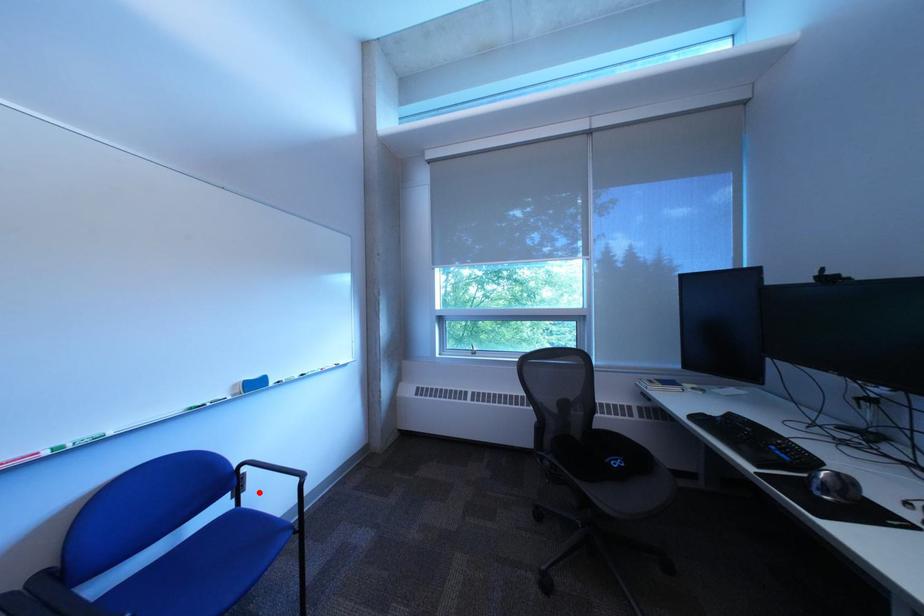
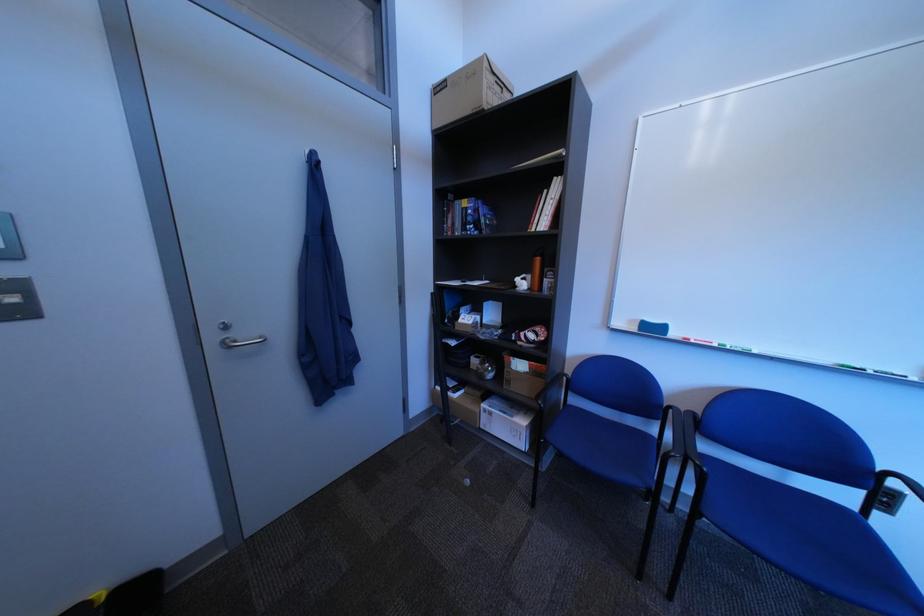
Locate, in the second image, the point that corresponds to the highlighted location in the first image.

(906, 516)